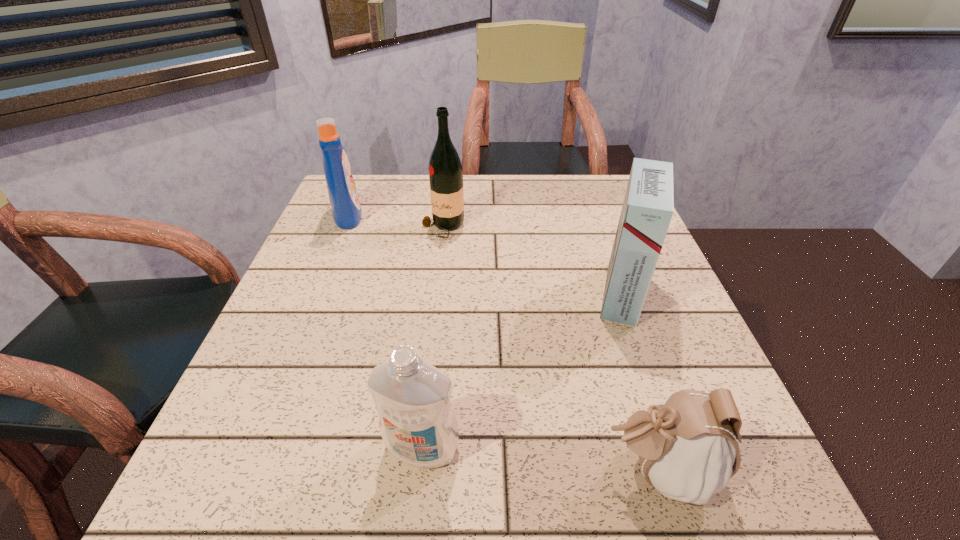
Locate an element on the screen. The width and height of the screenshot is (960, 540). wine bottle is located at coordinates (445, 170).

Image resolution: width=960 pixels, height=540 pixels. Identify the location of the left detergent. (346, 211).

Locate an element on the screen. the leftmost object is located at coordinates (346, 211).

The height and width of the screenshot is (540, 960). Find the location of `the third farthest object`. the third farthest object is located at coordinates (648, 207).

Where is `the shorter detergent`? The width and height of the screenshot is (960, 540). the shorter detergent is located at coordinates (417, 422).

Locate an element on the screen. the right detergent is located at coordinates (417, 422).

Identify the location of the shortest object. The image size is (960, 540). (687, 446).

At what (x,y) coordinates should I click in order to perform the action: click on free space located 0.250m on the left of the wine bottle. Please return your answer as a coordinate pair (x, y). The width and height of the screenshot is (960, 540). Looking at the image, I should click on (322, 228).

The width and height of the screenshot is (960, 540). Identify the location of vacant point located on the label of the left detergent. (464, 215).

Find the location of `vacant region located 0.070m on the left of the third farthest object`. vacant region located 0.070m on the left of the third farthest object is located at coordinates (559, 293).